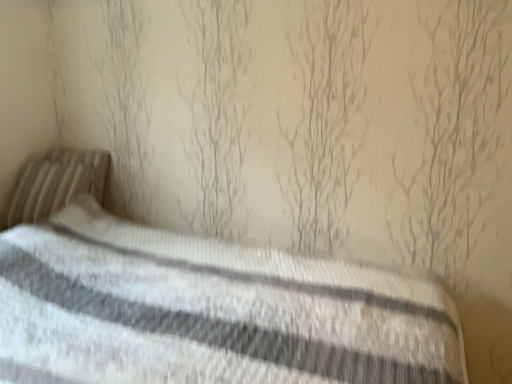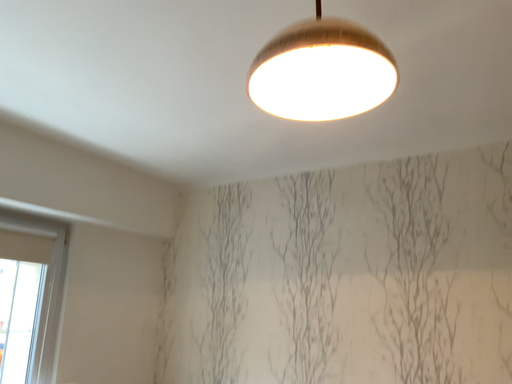
Question: Which way did the camera rotate in the video?

Choices:
 (A) rotated upward
 (B) rotated downward

Answer: (A)